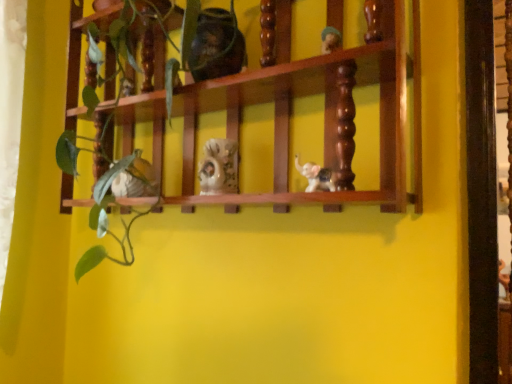
This screenshot has height=384, width=512. What do you see at coordinates (316, 176) in the screenshot?
I see `matte ceramic elephant at center, which ranks as the fourth toy in left-to-right order` at bounding box center [316, 176].

What is the approximate height of matte ceramic elephant at center, which appears as the 1th toy when viewed from the left?

It is 4.75 inches.

Describe the element at coordinates (216, 45) in the screenshot. The width and height of the screenshot is (512, 384). I see `matte brown vase at upper center, which is the 4th toy from bottom to top` at that location.

What is the approximate height of matte brown vase at upper center, which ranks as the second toy in left-to-right order?

matte brown vase at upper center, which ranks as the second toy in left-to-right order, is 6.26 inches in height.

The height and width of the screenshot is (384, 512). What are the coordinates of `porcelain figurine at center, which is the 2th toy from top to bottom` in the screenshot? It's located at (219, 167).

In terms of size, does wooden shelf at center appear bigger or smaller than matte ceramic elephant at center, which ranks as the fourth toy in left-to-right order?

wooden shelf at center is bigger than matte ceramic elephant at center, which ranks as the fourth toy in left-to-right order.

From a real-world perspective, is wooden shelf at center physically below matte ceramic elephant at center, which ranks as the fourth toy in left-to-right order?

Actually, wooden shelf at center is physically above matte ceramic elephant at center, which ranks as the fourth toy in left-to-right order, in the real world.

Considering the sizes of objects wooden shelf at center and matte ceramic elephant at center, the 1th toy in the right-to-left sequence, in the image provided, who is wider, wooden shelf at center or matte ceramic elephant at center, the 1th toy in the right-to-left sequence,?

With larger width is wooden shelf at center.

From the image's perspective, relative to green matte plant at center, is matte ceramic elephant at center, which appears as the 1th toy when viewed from the left, above or below?

matte ceramic elephant at center, which appears as the 1th toy when viewed from the left, is situated lower than green matte plant at center in the image.

In the scene shown: Which of these two, matte ceramic elephant at center, which ranks as the 3th toy in top-to-bottom order, or green matte plant at center, is smaller?

With smaller size is matte ceramic elephant at center, which ranks as the 3th toy in top-to-bottom order.

What's the angular difference between matte ceramic elephant at center, the second toy positioned from the bottom, and green matte plant at center's facing directions?

They differ by 0.00108 degrees in their facing directions.

Looking at this image, could you measure the distance between matte ceramic elephant at center, the second toy positioned from the bottom, and green matte plant at center?

matte ceramic elephant at center, the second toy positioned from the bottom, and green matte plant at center are 6.63 inches apart.

Is wooden shelf at center positioned with its back to porcelain figurine at center, which is the third toy in left-to-right order?

Yes, wooden shelf at center is facing away from porcelain figurine at center, which is the third toy in left-to-right order.

Is wooden shelf at center positioned beyond the bounds of porcelain figurine at center, which is the third toy in bottom-to-top order?

Result: Yes, wooden shelf at center is outside of porcelain figurine at center, which is the third toy in bottom-to-top order.

Is point (380, 151) closer to camera compared to point (215, 161)?

Yes.

Which is less distant, (x=189, y=84) or (x=230, y=61)?

Clearly, point (x=189, y=84) is closer to the camera than point (x=230, y=61).

Which object is positioned more to the right, wooden shelf at center or matte brown vase at upper center, which ranks as the second toy in left-to-right order?

matte brown vase at upper center, which ranks as the second toy in left-to-right order.

Is wooden shelf at center next to matte brown vase at upper center, which ranks as the second toy in left-to-right order?

They are not placed beside each other.

Measure the distance between wooden shelf at center and matte brown vase at upper center, which is the 4th toy from bottom to top.

They are 8.17 inches apart.

Is the position of green matte plant at center less distant than that of wooden shelf at center?

Yes, green matte plant at center is closer to the camera.

Looking at this image, from a real-world perspective, is green matte plant at center on wooden shelf at center?

No, from a real-world perspective, green matte plant at center is not above wooden shelf at center.

Is green matte plant at center oriented towards wooden shelf at center?

Yes, green matte plant at center is aimed at wooden shelf at center.

Find the location of `plant below the wooden shelf at center (from a real-world perspective)`. plant below the wooden shelf at center (from a real-world perspective) is located at coordinates (106, 221).

From a real-world perspective, which is physically above, matte ceramic elephant at center, which appears as the 1th toy when viewed from the left, or matte ceramic elephant at center, which is the 1th toy from bottom to top?

matte ceramic elephant at center, which appears as the 1th toy when viewed from the left, is physically above.

Could matte ceramic elephant at center, the fourth toy from the top, be considered to be inside matte ceramic elephant at center, which ranks as the 3th toy in top-to-bottom order?

That's incorrect, matte ceramic elephant at center, the fourth toy from the top, is not inside matte ceramic elephant at center, which ranks as the 3th toy in top-to-bottom order.

Considering the sizes of objects matte ceramic elephant at center, the second toy positioned from the bottom, and matte ceramic elephant at center, which is the 1th toy from bottom to top, in the image provided, who is thinner, matte ceramic elephant at center, the second toy positioned from the bottom, or matte ceramic elephant at center, which is the 1th toy from bottom to top,?

matte ceramic elephant at center, which is the 1th toy from bottom to top, is thinner.

Considering the points (142, 194) and (323, 174), which point is behind, point (142, 194) or point (323, 174)?

The point (142, 194) is behind.

Would you say matte ceramic elephant at center, the fourth toy from the top, is inside or outside porcelain figurine at center, which is the third toy in bottom-to-top order?

The correct answer is: outside.

Visually, is matte ceramic elephant at center, the fourth toy from the top, positioned to the left or to the right of porcelain figurine at center, which is the 2th toy from top to bottom?

In the image, matte ceramic elephant at center, the fourth toy from the top, appears on the right side of porcelain figurine at center, which is the 2th toy from top to bottom.

Can you confirm if matte ceramic elephant at center, the fourth toy from the top, is wider than porcelain figurine at center, which ranks as the second toy in right-to-left order?

No.

From a real-world perspective, count 3rd toys downward from the wooden shelf at center and point to it. Please provide its 2D coordinates.

[(316, 176)]

In order to click on the 2nd toy below when counting from the green matte plant at center (from the image's perspective) in this screenshot , I will do `click(135, 180)`.

From the image, which object appears to be nearer to matte ceramic elephant at center, the second toy positioned from the bottom, porcelain figurine at center, which ranks as the second toy in right-to-left order, or matte brown vase at upper center, the third toy in the right-to-left sequence?

porcelain figurine at center, which ranks as the second toy in right-to-left order.

From the image, which object appears to be nearer to matte brown vase at upper center, the third toy in the right-to-left sequence, matte ceramic elephant at center, which is the 1th toy from bottom to top, or wooden shelf at center?

The object closer to matte brown vase at upper center, the third toy in the right-to-left sequence, is wooden shelf at center.

Which object lies nearer to the anchor point matte ceramic elephant at center, which ranks as the 3th toy in top-to-bottom order, wooden shelf at center or matte ceramic elephant at center, which ranks as the fourth toy in left-to-right order?

The object closer to matte ceramic elephant at center, which ranks as the 3th toy in top-to-bottom order, is wooden shelf at center.

Based on their spatial positions, is green matte plant at center or porcelain figurine at center, which is the 2th toy from top to bottom, further from matte ceramic elephant at center, the fourth toy from the top?

Among the two, green matte plant at center is located further to matte ceramic elephant at center, the fourth toy from the top.

Considering their positions, is matte ceramic elephant at center, which is the 1th toy from bottom to top, positioned closer to porcelain figurine at center, which is the third toy in bottom-to-top order, than matte brown vase at upper center, which is the 4th toy from bottom to top?

matte ceramic elephant at center, which is the 1th toy from bottom to top, lies closer to porcelain figurine at center, which is the third toy in bottom-to-top order, than the other object.

Which object lies further to the anchor point green matte plant at center, matte ceramic elephant at center, which is the 1th toy from bottom to top, or wooden shelf at center?

matte ceramic elephant at center, which is the 1th toy from bottom to top, is further to green matte plant at center.

Which object lies further to the anchor point green matte plant at center, matte ceramic elephant at center, which ranks as the 3th toy in top-to-bottom order, or porcelain figurine at center, which is the 2th toy from top to bottom?

porcelain figurine at center, which is the 2th toy from top to bottom.

From the image, which object appears to be nearer to green matte plant at center, porcelain figurine at center, which is the third toy in bottom-to-top order, or matte brown vase at upper center, which is the 4th toy from bottom to top?

matte brown vase at upper center, which is the 4th toy from bottom to top, is closer to green matte plant at center.

Identify the location of toy between matte brown vase at upper center, which ranks as the second toy in left-to-right order, and matte ceramic elephant at center, which appears as the 1th toy when viewed from the left, in the up-down direction. (219, 167).

Find the location of a particular element. Image resolution: width=512 pixels, height=384 pixels. shelf between green matte plant at center and matte brown vase at upper center, which ranks as the second toy in left-to-right order, in the front-back direction is located at coordinates (327, 105).

At what (x,y) coordinates should I click in order to perform the action: click on shelf situated between green matte plant at center and matte ceramic elephant at center, the 1th toy in the right-to-left sequence, from left to right. Please return your answer as a coordinate pair (x, y). Looking at the image, I should click on (327, 105).

What are the coordinates of `shelf between matte brown vase at upper center, which ranks as the second toy in left-to-right order, and matte ceramic elephant at center, which is the 1th toy from bottom to top, vertically` in the screenshot? It's located at (327, 105).